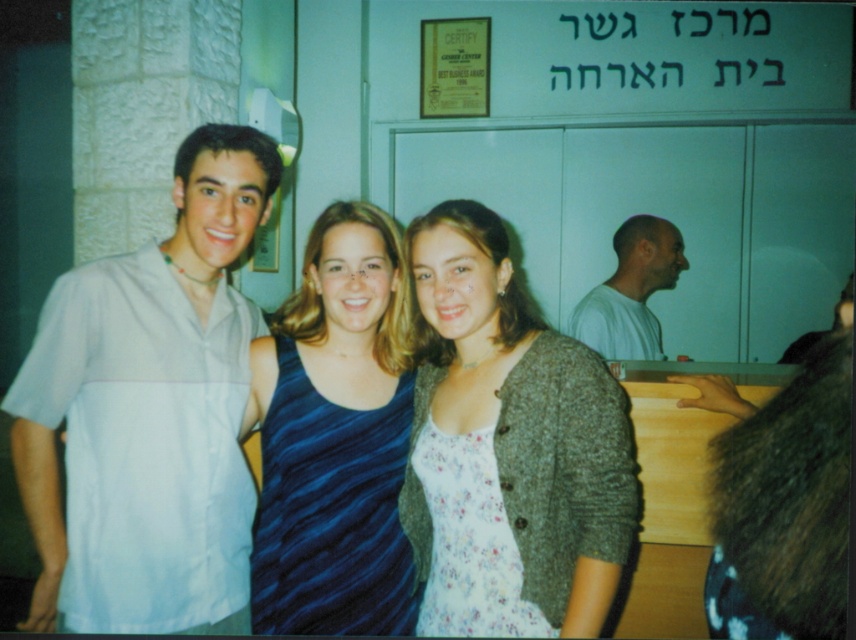
In the scene shown: Does floral cotton dress at center lie in front of blue striped tank top at center?

Yes, floral cotton dress at center is in front of blue striped tank top at center.

Does floral cotton dress at center have a lesser height compared to blue striped tank top at center?

Yes, floral cotton dress at center is shorter than blue striped tank top at center.

Is point (536, 376) farther from camera compared to point (390, 554)?

No.

This screenshot has width=856, height=640. In order to click on floral cotton dress at center in this screenshot , I will do `click(509, 449)`.

Between white cotton shirt at left and blue striped tank top at center, which one appears on the left side from the viewer's perspective?

From the viewer's perspective, white cotton shirt at left appears more on the left side.

From the picture: Is white cotton shirt at left above blue striped tank top at center?

Correct, white cotton shirt at left is located above blue striped tank top at center.

Who is more forward, (218, 544) or (367, 532)?

Point (367, 532) is more forward.

Where is `white cotton shirt at left`? This screenshot has width=856, height=640. white cotton shirt at left is located at coordinates (149, 413).

Is blue striped tank top at center further to the viewer compared to white cotton shirt at right?

No, blue striped tank top at center is closer to the viewer.

Measure the distance between blue striped tank top at center and camera.

A distance of 5.23 feet exists between blue striped tank top at center and camera.

The width and height of the screenshot is (856, 640). I want to click on blue striped tank top at center, so click(336, 436).